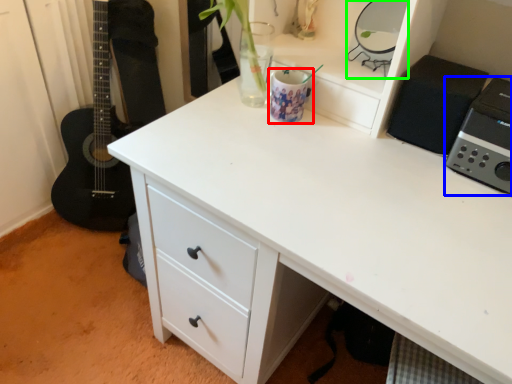
Question: Which object is the closest to the appliance (highlighted by a red box)? Choose among these: appliance (highlighted by a blue box) or appliance (highlighted by a green box).

Choices:
 (A) appliance
 (B) appliance

Answer: (B)